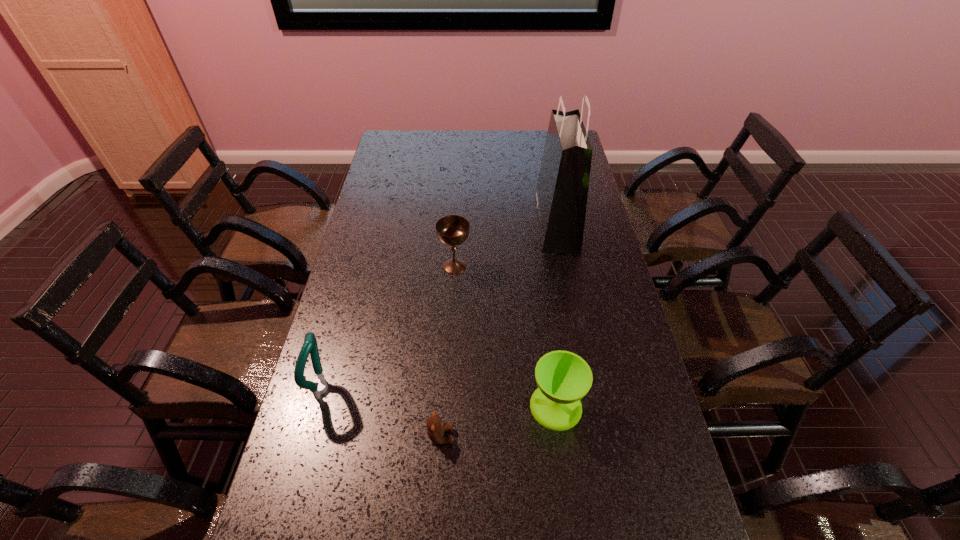
Image resolution: width=960 pixels, height=540 pixels. What are the coordinates of `the farthest object` in the screenshot? It's located at (561, 194).

Where is `shopping bag`? The height and width of the screenshot is (540, 960). shopping bag is located at coordinates (561, 194).

I want to click on the second tallest object, so click(319, 386).

Where is `bottle opener`? The width and height of the screenshot is (960, 540). bottle opener is located at coordinates (319, 386).

The width and height of the screenshot is (960, 540). I want to click on the second farthest object, so click(452, 230).

I want to click on the fourth tallest object, so click(x=564, y=378).

Locate an element on the screen. Image resolution: width=960 pixels, height=540 pixels. teddy bear is located at coordinates (435, 427).

The image size is (960, 540). In order to click on free space located 0.230m on the front with handles of the farthest object in this screenshot , I will do `click(474, 224)`.

You are a GUI agent. You are given a task and a screenshot of the screen. Output one action in this format:
    pyautogui.click(x=<x>, y=<y>)
    Task: Click on the free space located 0.170m on the front with handles of the farthest object
    The height and width of the screenshot is (540, 960).
    Given the screenshot: What is the action you would take?
    pyautogui.click(x=491, y=224)

Where is `free space located 0.160m on the front with handles of the farthest object`? free space located 0.160m on the front with handles of the farthest object is located at coordinates (493, 224).